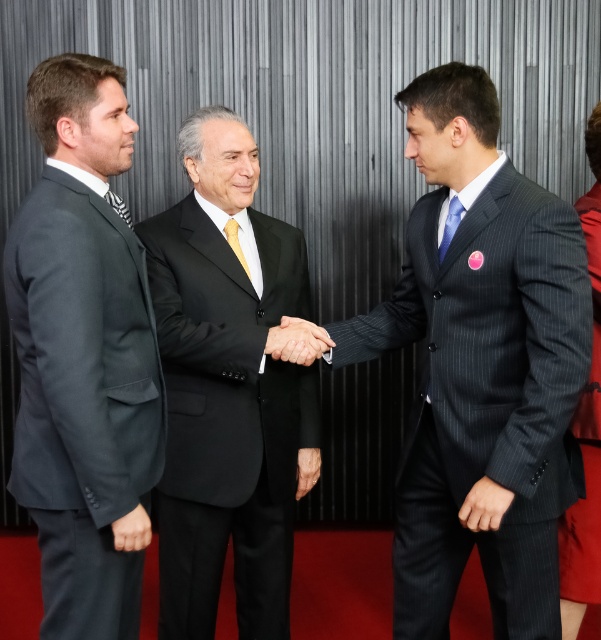
Is smooth black hand at center below yellow satin tie at center?

Yes, smooth black hand at center is below yellow satin tie at center.

Can you confirm if smooth black hand at center is shorter than yellow satin tie at center?

Correct, smooth black hand at center is not as tall as yellow satin tie at center.

Which is behind, point (296, 362) or point (231, 241)?

The point (231, 241) is behind.

This screenshot has height=640, width=601. What are the coordinates of `smooth black hand at center` in the screenshot? It's located at (296, 340).

Does dark gray pinstripe suit at center have a greater width compared to black pinstripe suit at center?

Yes.

Find the location of a particular element. dark gray pinstripe suit at center is located at coordinates (481, 369).

Where is `dark gray pinstripe suit at center`? This screenshot has width=601, height=640. dark gray pinstripe suit at center is located at coordinates (481, 369).

Is dark gray suit at left taller than smooth black hand at center?

Correct, dark gray suit at left is much taller as smooth black hand at center.

The image size is (601, 640). What do you see at coordinates (84, 356) in the screenshot? I see `dark gray suit at left` at bounding box center [84, 356].

What do you see at coordinates (84, 356) in the screenshot? This screenshot has height=640, width=601. I see `dark gray suit at left` at bounding box center [84, 356].

Where is `dark gray suit at left`? The height and width of the screenshot is (640, 601). dark gray suit at left is located at coordinates (84, 356).